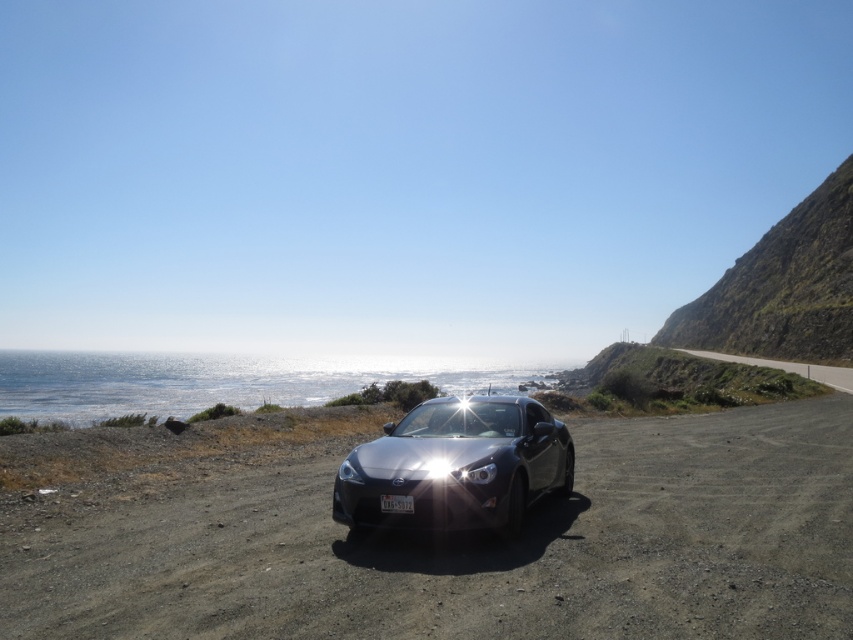
Question: Which of these objects is positioned farthest from the satin silver car at center?

Choices:
 (A) matte silver headlight at center
 (B) sandy/dirt road at center

Answer: (B)

Question: Is sandy/dirt road at center smaller than satin silver car at center?

Choices:
 (A) no
 (B) yes

Answer: (A)

Question: Which object appears closest to the camera in this image?

Choices:
 (A) matte silver headlight at center
 (B) satin silver car at center

Answer: (B)

Question: Does sandy/dirt road at center appear under matte silver headlight at center?

Choices:
 (A) yes
 (B) no

Answer: (A)

Question: Which of these objects is positioned closest to the matte silver headlight at center?

Choices:
 (A) sandy/dirt road at center
 (B) satin silver car at center

Answer: (B)

Question: Is sandy/dirt road at center further to the viewer compared to satin silver car at center?

Choices:
 (A) yes
 (B) no

Answer: (B)